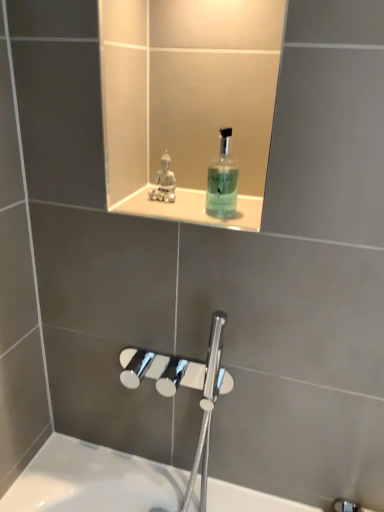
This screenshot has width=384, height=512. Find the location of `vacant space behind translucent glass mouthwash at upper center`. vacant space behind translucent glass mouthwash at upper center is located at coordinates (211, 202).